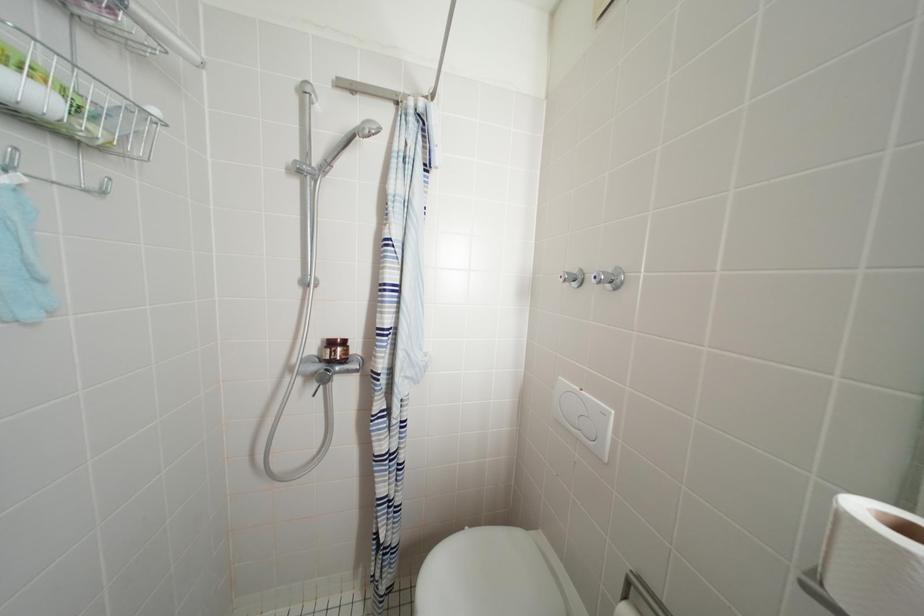
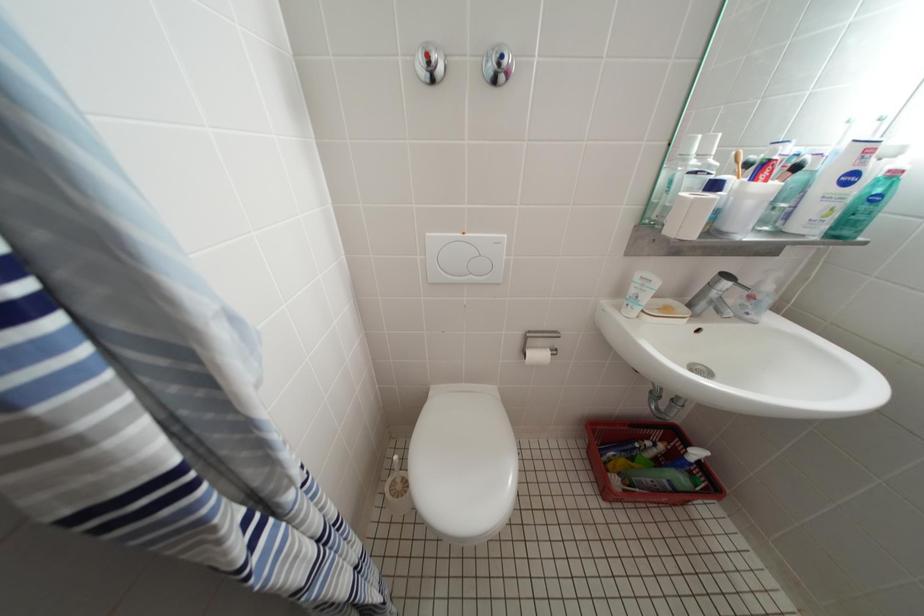
From the picture: The images are taken continuously from a first-person perspective. In which direction is your viewpoint rotating?

The camera rotated toward right-down.